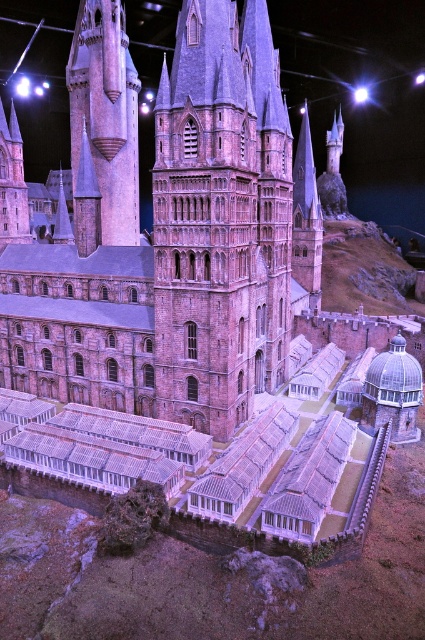
Measure the distance between point [286,330] and camera.

Point [286,330] is 208.47 feet from camera.

Describe the element at coordinates (221, 218) in the screenshot. I see `brick stone tower at center` at that location.

Locate an element on the screen. brick stone tower at center is located at coordinates (221, 218).

I want to click on brick stone tower at center, so click(x=221, y=218).

Locate an element on the screen. Image resolution: width=425 pixels, height=640 pixels. brick stone tower at center is located at coordinates (221, 218).

Is brick stone tower at center bigger than smooth stone tower at upper left?

No.

You are a GUI agent. You are given a task and a screenshot of the screen. Output one action in this format:
    pyautogui.click(x=<x>, y=<y>)
    Task: Click on the brick stone tower at center
    
    Given the screenshot: What is the action you would take?
    pyautogui.click(x=221, y=218)

Is smooth stone tower at upper left thinner than brick tower at left?

Correct, smooth stone tower at upper left's width is less than brick tower at left's.

The height and width of the screenshot is (640, 425). What do you see at coordinates (107, 113) in the screenshot?
I see `smooth stone tower at upper left` at bounding box center [107, 113].

Where is `smooth stone tower at upper left`? The image size is (425, 640). smooth stone tower at upper left is located at coordinates (107, 113).